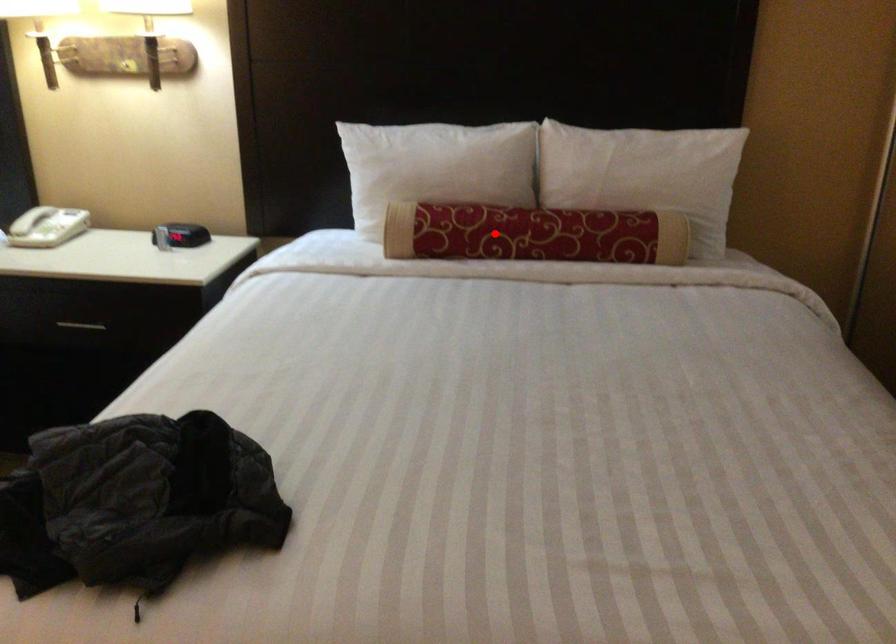
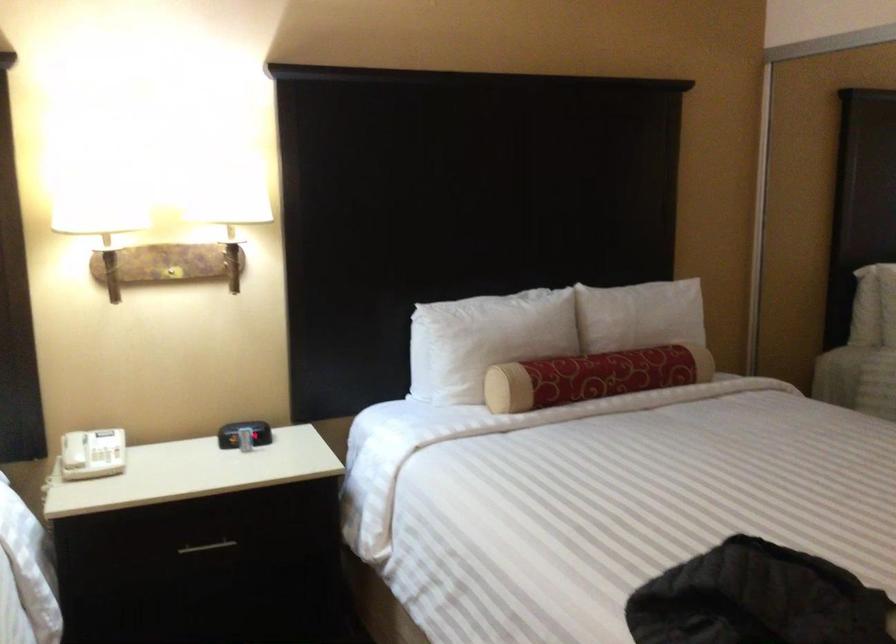
Question: I am providing you with two images of the same scene from different viewpoints. In image1, a red point is highlighted. Considering the same 3D point in image2, which of the following is correct?

Choices:
 (A) It is closer
 (B) It is farther

Answer: (B)